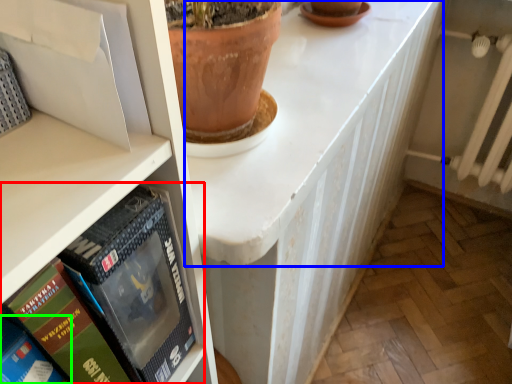
Question: Considering the real-world distances, which object is farthest from book (highlighted by a red box)? counter top (highlighted by a blue box) or book (highlighted by a green box)?

Choices:
 (A) counter top
 (B) book

Answer: (A)